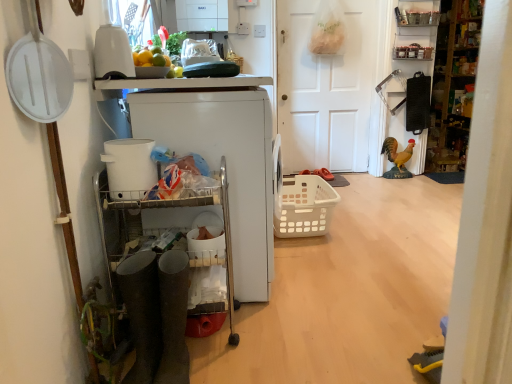
In order to face rubber sole shoe at center, should I rotate leftwards or rightwards?

Rotate your view right by about 9.226°.

What do you see at coordinates (324, 174) in the screenshot? I see `rubber sole shoe at center` at bounding box center [324, 174].

Where is `wooden shelves at right, the 2th cabinetry from the front`? wooden shelves at right, the 2th cabinetry from the front is located at coordinates (455, 85).

Consider the image. In order to face white plastic cart at left, the 1th appliance viewed from the back, should I rotate leftwards or rightwards?

You should rotate left by 5.956 degrees.

How much space does metallic silver shelf at upper right, which is the 1th shelf in top-to-bottom order, occupy horizontally?

metallic silver shelf at upper right, which is the 1th shelf in top-to-bottom order, is 4.52 inches wide.

In order to face metallic gray boots at left, which appears as the 1th cabinetry when viewed from the front, should I rotate leftwards or rightwards?

Turn left by 10.536 degrees to look at metallic gray boots at left, which appears as the 1th cabinetry when viewed from the front.

Measure the distance between yellow matte rooster at right and camera.

They are 3.59 meters apart.

Locate an element on the screen. rubber sole shoe at center is located at coordinates (324, 174).

From a real-world perspective, is white plastic cart at left, the 1th appliance viewed from the back, over white plastic basket at center?

Indeed, from a real-world perspective, white plastic cart at left, the 1th appliance viewed from the back, stands above white plastic basket at center.

Can we say white plastic cart at left, the 1th appliance viewed from the back, lies outside white plastic basket at center?

white plastic cart at left, the 1th appliance viewed from the back, is positioned outside white plastic basket at center.

Does white plastic cart at left, the 1th appliance viewed from the back, appear on the left side of white plastic basket at center?

Yes.

Are white plastic cart at left, the 1th appliance viewed from the back, and white plastic basket at center making contact?

No, white plastic cart at left, the 1th appliance viewed from the back, is not in contact with white plastic basket at center.

Looking at their sizes, would you say white plastic bucket at left, positioned as the 1th appliance in front-to-back order, is wider or thinner than metallic silver shelf at upper right, which is the 1th shelf in top-to-bottom order?

white plastic bucket at left, positioned as the 1th appliance in front-to-back order, is wider than metallic silver shelf at upper right, which is the 1th shelf in top-to-bottom order.

Is white plastic bucket at left, positioned as the 1th appliance in front-to-back order, spatially inside metallic silver shelf at upper right, placed as the 2th shelf when sorted from bottom to top, or outside of it?

white plastic bucket at left, positioned as the 1th appliance in front-to-back order, exists outside the volume of metallic silver shelf at upper right, placed as the 2th shelf when sorted from bottom to top.

Considering the sizes of objects white plastic bucket at left, positioned as the 1th appliance in front-to-back order, and metallic silver shelf at upper right, placed as the 2th shelf when sorted from bottom to top, in the image provided, who is smaller, white plastic bucket at left, positioned as the 1th appliance in front-to-back order, or metallic silver shelf at upper right, placed as the 2th shelf when sorted from bottom to top,?

white plastic bucket at left, positioned as the 1th appliance in front-to-back order, is smaller.

Considering the relative sizes of white plastic bucket at left, positioned as the 1th appliance in front-to-back order, and metallic silver shelf at upper right, which is the 1th shelf in top-to-bottom order, in the image provided, is white plastic bucket at left, positioned as the 1th appliance in front-to-back order, shorter than metallic silver shelf at upper right, which is the 1th shelf in top-to-bottom order,?

Yes, white plastic bucket at left, positioned as the 1th appliance in front-to-back order, is shorter than metallic silver shelf at upper right, which is the 1th shelf in top-to-bottom order.

Is wooden shelves at right, the 2th cabinetry viewed from the left, positioned with its back to yellow matte rooster at right?

No, wooden shelves at right, the 2th cabinetry viewed from the left, is not facing away from yellow matte rooster at right.

Would you say wooden shelves at right, which is the 2th cabinetry in bottom-to-top order, is inside or outside yellow matte rooster at right?

wooden shelves at right, which is the 2th cabinetry in bottom-to-top order, is not enclosed by yellow matte rooster at right.

Based on the photo, in terms of height, does wooden shelves at right, which is the 2th cabinetry in bottom-to-top order, look taller or shorter compared to yellow matte rooster at right?

Considering their sizes, wooden shelves at right, which is the 2th cabinetry in bottom-to-top order, has more height than yellow matte rooster at right.

Is white plastic basket at center far away from metallic silver spice rack at upper right, which is the 1th shelf in bottom-to-top order?

That's right, there is a large distance between white plastic basket at center and metallic silver spice rack at upper right, which is the 1th shelf in bottom-to-top order.

Between white plastic basket at center and metallic silver spice rack at upper right, which is the 1th shelf in bottom-to-top order, which one has smaller size?

metallic silver spice rack at upper right, which is the 1th shelf in bottom-to-top order, is smaller.

From the image's perspective, who appears lower, white plastic basket at center or metallic silver spice rack at upper right, which is the 1th shelf in bottom-to-top order?

From the image's view, white plastic basket at center is below.

Could you tell me if white plastic bucket at left, placed as the third appliance when sorted from back to front, is turned towards rubber sole shoe at center?

No, white plastic bucket at left, placed as the third appliance when sorted from back to front, does not turn towards rubber sole shoe at center.

Between white plastic bucket at left, placed as the third appliance when sorted from back to front, and rubber sole shoe at center, which one has smaller width?

With smaller width is white plastic bucket at left, placed as the third appliance when sorted from back to front.

Looking at this image, is white plastic bucket at left, placed as the third appliance when sorted from back to front, in front of or behind rubber sole shoe at center in the image?

Visually, white plastic bucket at left, placed as the third appliance when sorted from back to front, is located in front of rubber sole shoe at center.

From the image's perspective, relative to metallic silver shelf at upper right, which is the 1th shelf in top-to-bottom order, is yellow matte rooster at right above or below?

yellow matte rooster at right is situated lower than metallic silver shelf at upper right, which is the 1th shelf in top-to-bottom order, in the image.

Is yellow matte rooster at right closer to camera compared to metallic silver shelf at upper right, which is the 1th shelf in top-to-bottom order?

No, yellow matte rooster at right is further to the viewer.

Considering the sizes of objects yellow matte rooster at right and metallic silver shelf at upper right, placed as the 2th shelf when sorted from bottom to top, in the image provided, who is wider, yellow matte rooster at right or metallic silver shelf at upper right, placed as the 2th shelf when sorted from bottom to top,?

With larger width is metallic silver shelf at upper right, placed as the 2th shelf when sorted from bottom to top.

Considering the relative sizes of rubber sole shoe at center and white plastic blender at upper center, the second appliance when ordered from back to front, in the image provided, is rubber sole shoe at center wider than white plastic blender at upper center, the second appliance when ordered from back to front,?

Correct, the width of rubber sole shoe at center exceeds that of white plastic blender at upper center, the second appliance when ordered from back to front.

Measure the distance between rubber sole shoe at center and white plastic blender at upper center, the second appliance when ordered from back to front.

Result: rubber sole shoe at center is 8.08 feet away from white plastic blender at upper center, the second appliance when ordered from back to front.

From the image's perspective, which is above, rubber sole shoe at center or white plastic blender at upper center, the second appliance when ordered from back to front?

white plastic blender at upper center, the second appliance when ordered from back to front, is shown above in the image.

Can we say rubber sole shoe at center lies outside white plastic blender at upper center, the second appliance when ordered from back to front?

rubber sole shoe at center is positioned outside white plastic blender at upper center, the second appliance when ordered from back to front.

Starting from the white plastic basket at center, which appliance is the 1st one in front? Please provide its 2D coordinates.

[(226, 162)]

Identify the location of the 2nd appliance positioned below the metallic silver shelf at upper right, placed as the 2th shelf when sorted from bottom to top (from a real-world perspective). (129, 168).

Based on their spatial positions, is white matte door at center or wooden shelves at right, which is the 2th cabinetry in bottom-to-top order, further from metallic silver spice rack at upper right, the second shelf viewed from the top?

Among the two, wooden shelves at right, which is the 2th cabinetry in bottom-to-top order, is located further to metallic silver spice rack at upper right, the second shelf viewed from the top.

From the image, which object appears to be farther from metallic gray boots at left, the second cabinetry from the back, metallic silver spice rack at upper right, which is the 1th shelf in bottom-to-top order, or metallic silver shelf at upper right, which is the 1th shelf in top-to-bottom order?

Among the two, metallic silver shelf at upper right, which is the 1th shelf in top-to-bottom order, is located further to metallic gray boots at left, the second cabinetry from the back.

Estimate the real-world distances between objects in this image. Which object is further from white plastic blender at upper center, the second appliance when ordered from back to front, wooden shelves at right, the 2th cabinetry viewed from the left, or white plastic basket at center?

The object further to white plastic blender at upper center, the second appliance when ordered from back to front, is wooden shelves at right, the 2th cabinetry viewed from the left.

Based on their spatial positions, is metallic gray boots at left, which ranks as the 1th cabinetry in bottom-to-top order, or white plastic basket at center closer to white plastic bucket at left, positioned as the 1th appliance in front-to-back order?

metallic gray boots at left, which ranks as the 1th cabinetry in bottom-to-top order.

From the image, which object appears to be nearer to white plastic blender at upper center, the second appliance positioned from the front, white plastic basket at center or yellow matte rooster at right?

Based on the image, white plastic basket at center appears to be nearer to white plastic blender at upper center, the second appliance positioned from the front.

Looking at the image, which one is located closer to white plastic basket at center, rubber sole shoe at center or metallic silver spice rack at upper right, which is the 1th shelf in bottom-to-top order?

rubber sole shoe at center is positioned closer to the anchor white plastic basket at center.

Estimate the real-world distances between objects in this image. Which object is further from white plastic blender at upper center, the second appliance positioned from the front, rubber sole shoe at center or metallic silver spice rack at upper right, the second shelf viewed from the top?

metallic silver spice rack at upper right, the second shelf viewed from the top, is positioned further to the anchor white plastic blender at upper center, the second appliance positioned from the front.

Considering their positions, is metallic silver spice rack at upper right, which is the 1th shelf in bottom-to-top order, positioned further to metallic silver shelf at upper right, which is the 1th shelf in top-to-bottom order, than rubber sole shoe at center?

rubber sole shoe at center is further to metallic silver shelf at upper right, which is the 1th shelf in top-to-bottom order.

At what (x,y) coordinates should I click in order to perform the action: click on appliance located between white plastic blender at upper center, the second appliance when ordered from back to front, and metallic silver spice rack at upper right, which is the 1th shelf in bottom-to-top order, in the depth direction. Please return your answer as a coordinate pair (x, y). Looking at the image, I should click on (226, 162).

Find the location of a particular element. door between white plastic basket at center and rubber sole shoe at center along the z-axis is located at coordinates (326, 88).

This screenshot has width=512, height=384. I want to click on door between metallic gray boots at left, the second cabinetry from the back, and wooden shelves at right, marked as the 1th cabinetry in a top-to-bottom arrangement, along the z-axis, so click(326, 88).

What are the coordinates of `toy positioned between white plastic blender at upper center, the second appliance when ordered from back to front, and rubber sole shoe at center from near to far` in the screenshot? It's located at (397, 158).